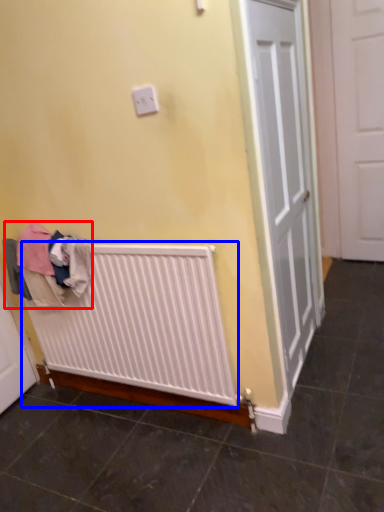
Question: Among these objects, which one is nearest to the camera, clothing (highlighted by a red box) or radiator (highlighted by a blue box)?

Choices:
 (A) clothing
 (B) radiator

Answer: (B)